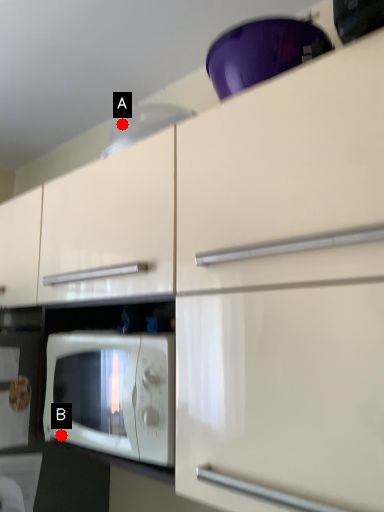
Question: Two points are circled on the image, labeled by A and B beside each circle. Which point appears farthest from the camera in this image?

Choices:
 (A) A is further
 (B) B is further

Answer: (A)